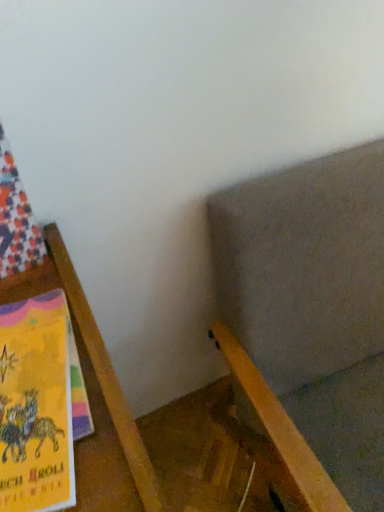
Consider the image. In order to face wooden bookshelf at left, should I rotate leftwards or rightwards?

To face it directly, rotate left by 19.499 degrees.

The width and height of the screenshot is (384, 512). Find the location of `wooden bookshelf at left`. wooden bookshelf at left is located at coordinates point(95,398).

What do you see at coordinates (95, 398) in the screenshot? I see `wooden bookshelf at left` at bounding box center [95, 398].

Measure the distance between point (370, 461) and camera.

76.70 centimeters.

This screenshot has width=384, height=512. What are the coordinates of `wooden chair at lower right` in the screenshot? It's located at pos(313,303).

Describe the element at coordinates (313, 303) in the screenshot. I see `wooden chair at lower right` at that location.

Find the location of `wooden bookshelf at left`. wooden bookshelf at left is located at coordinates (95, 398).

Would you say wooden bookshelf at left is to the left or to the right of wooden chair at lower right in the picture?

From the image, it's evident that wooden bookshelf at left is to the left of wooden chair at lower right.

Who is more distant, wooden bookshelf at left or wooden chair at lower right?

wooden chair at lower right.

Is point (96, 362) closer to viewer compared to point (313, 291)?

Yes, point (96, 362) is closer to viewer.

From the image's perspective, would you say wooden bookshelf at left is shown under wooden chair at lower right?

Yes, from the image's perspective, wooden bookshelf at left is below wooden chair at lower right.

From a real-world perspective, is wooden bookshelf at left positioned under wooden chair at lower right based on gravity?

Correct, in the physical world, wooden bookshelf at left is lower than wooden chair at lower right.

Does wooden bookshelf at left have a greater width compared to wooden chair at lower right?

No.

Does wooden bookshelf at left have a lesser height compared to wooden chair at lower right?

Correct, wooden bookshelf at left is not as tall as wooden chair at lower right.

Which of these two, wooden bookshelf at left or wooden chair at lower right, is bigger?

wooden chair at lower right.

Is wooden bookshelf at left situated inside wooden chair at lower right or outside?

wooden bookshelf at left cannot be found inside wooden chair at lower right.

Is wooden bookshelf at left with wooden chair at lower right?

wooden bookshelf at left and wooden chair at lower right are not in contact.

Is wooden bookshelf at left turned away from wooden chair at lower right?

No, wooden bookshelf at left's orientation is not away from wooden chair at lower right.

How different are the orientations of wooden bookshelf at left and wooden chair at lower right in degrees?

The angle between the facing direction of wooden bookshelf at left and the facing direction of wooden chair at lower right is 0.000151 degrees.

You are a GUI agent. You are given a task and a screenshot of the screen. Output one action in this format:
    pyautogui.click(x=<x>, y=<y>)
    Task: Click on the furniture directly beneath the wooden chair at lower right (from a real-world perspective)
    
    Given the screenshot: What is the action you would take?
    (x=95, y=398)

Is wooden chair at lower right to the left of wooden bookshelf at left from the viewer's perspective?

No, wooden chair at lower right is not to the left of wooden bookshelf at left.

Does wooden chair at lower right lie behind wooden bookshelf at left?

Yes, wooden chair at lower right is further from the camera.

Does point (366, 201) come closer to viewer compared to point (95, 477)?

No, it is not.

From the image's perspective, would you say wooden chair at lower right is positioned over wooden bookshelf at left?

Yes, from the image's perspective, wooden chair at lower right is above wooden bookshelf at left.

From a real-world perspective, who is located lower, wooden chair at lower right or wooden bookshelf at left?

From a 3D spatial view, wooden bookshelf at left is below.

Can you confirm if wooden chair at lower right is thinner than wooden bookshelf at left?

No, wooden chair at lower right is not thinner than wooden bookshelf at left.

Who is taller, wooden chair at lower right or wooden bookshelf at left?

Standing taller between the two is wooden chair at lower right.

Who is smaller, wooden chair at lower right or wooden bookshelf at left?

With smaller size is wooden bookshelf at left.

Could wooden bookshelf at left be considered to be inside wooden chair at lower right?

Actually, wooden bookshelf at left is outside wooden chair at lower right.

Is wooden chair at lower right directly adjacent to wooden bookshelf at left?

wooden chair at lower right and wooden bookshelf at left are clearly separated.

Is wooden chair at lower right facing away from wooden bookshelf at left?

wooden chair at lower right does not have its back to wooden bookshelf at left.

How far apart are wooden chair at lower right and wooden bookshelf at left?

wooden chair at lower right and wooden bookshelf at left are 41.06 centimeters apart.

Locate an element on the screen. chair that appears above the wooden bookshelf at left (from a real-world perspective) is located at coordinates (313, 303).

Identify the location of chair above the wooden bookshelf at left (from the image's perspective). (313, 303).

This screenshot has width=384, height=512. I want to click on furniture in front of the wooden chair at lower right, so (x=95, y=398).